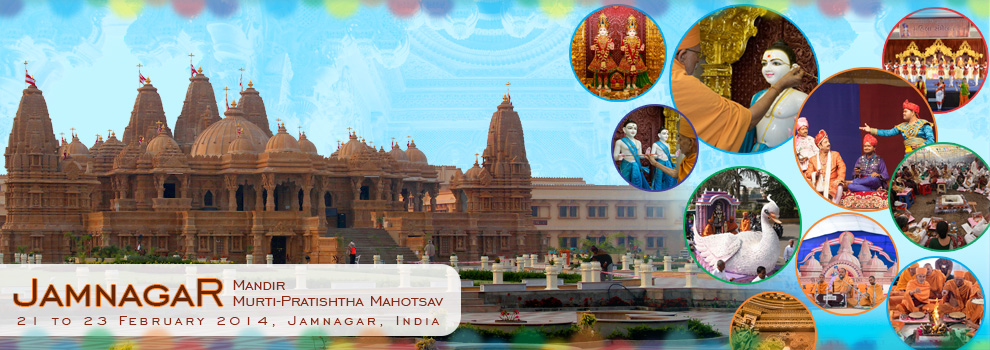
This screenshot has width=990, height=350. In order to click on 1 large fake bird in this screenshot , I will do `click(756, 248)`.